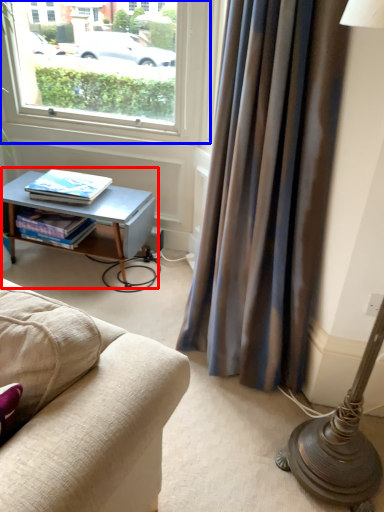
Question: Which point is closer to the camera, table (highlighted by a red box) or window (highlighted by a blue box)?

Choices:
 (A) table
 (B) window

Answer: (B)